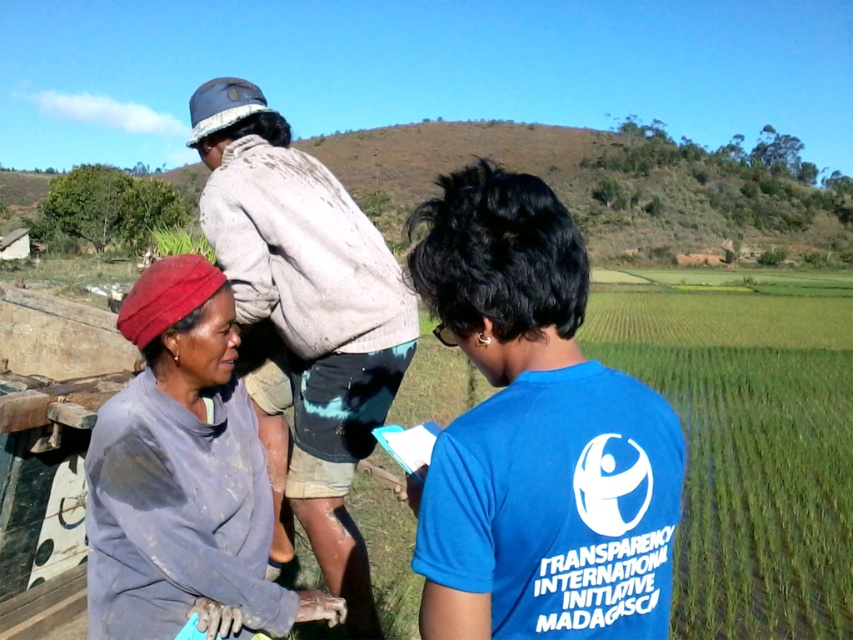
Question: Which of the following is the farthest from the observer?

Choices:
 (A) dirty gray fabric at lower left
 (B) muddy gray shirt at upper center
 (C) blue cotton shirt at center

Answer: (B)

Question: Is muddy gray shirt at upper center bigger than dirty gray fabric at lower left?

Choices:
 (A) no
 (B) yes

Answer: (B)

Question: Which point is farther to the camera?

Choices:
 (A) (519, 209)
 (B) (86, 458)
 (C) (325, 452)

Answer: (C)

Question: Is muddy gray shirt at upper center closer to the viewer compared to dirty gray fabric at lower left?

Choices:
 (A) yes
 (B) no

Answer: (B)

Question: Which of the following is the closest to the observer?

Choices:
 (A) (271, 387)
 (B) (489, 508)

Answer: (B)

Question: Is muddy gray shirt at upper center to the left of dirty gray fabric at lower left from the viewer's perspective?

Choices:
 (A) yes
 (B) no

Answer: (B)